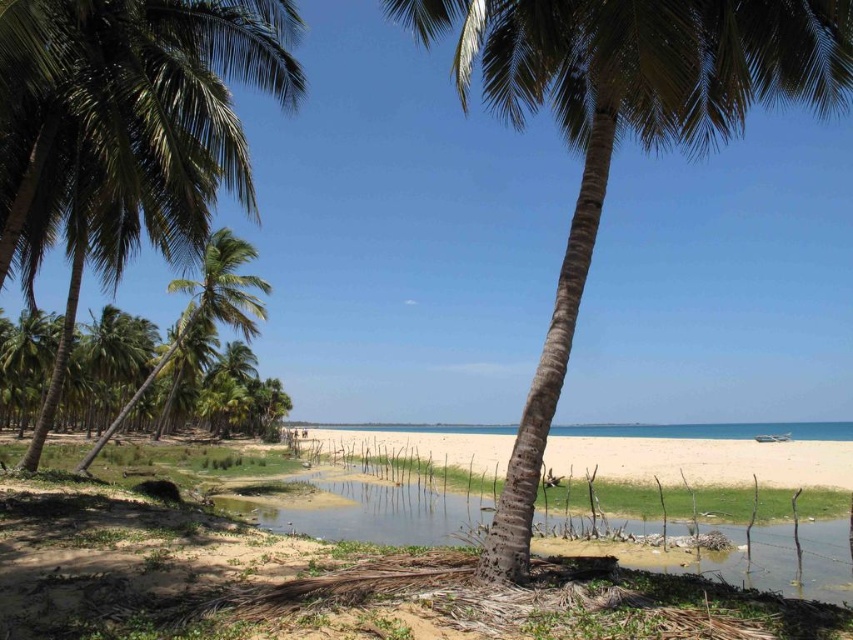
You are standing on the beach and want to take a photo of the green leafy palm tree at center. If your camera has a maximum focus range of 5 meters, will you need to move closer to the tree to get a clear shot?

The green leafy palm tree at center is 5.35 meters away from the viewer. Since the camera can only focus up to 5 meters, you need to move closer to ensure the tree is within the focus range.

You are standing at the beach and want to take a photo of the green leafy coconut tree at left. If your camera can focus on objects up to 8 meters away, will you be able to capture the tree clearly?

The green leafy coconut tree at left is 7.96 meters away from the camera, which is within the camera focus range of up to 8 meters. Therefore, you can capture the tree clearly.

You are standing on the beach and want to take a photo of both the palm trees and the tidal pool. You notice two points marked on your map at coordinates point (140,132) and point (772,538). Which point is better to stand at to ensure both the palm trees in the foreground and the tidal pool in the midground are clearly visible in your photo?

Point (140,132) is closer to the camera than point (772,538), so standing at point (140,132) will allow you to capture both the palm trees and the tidal pool more clearly in the frame.